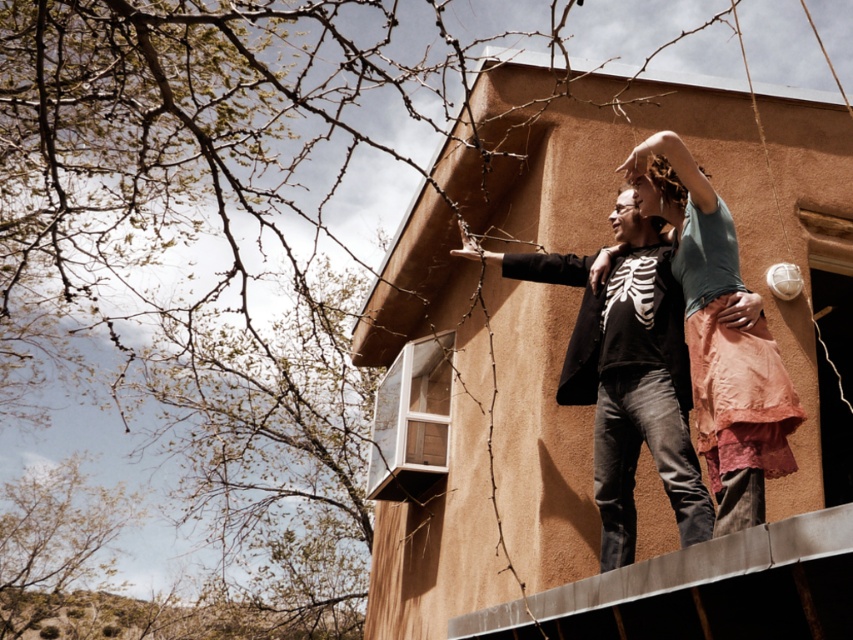
Is matte black skeleton shirt at center above light blue cotton shirt at center?

No.

Who is positioned more to the left, matte black skeleton shirt at center or light blue cotton shirt at center?

Positioned to the left is matte black skeleton shirt at center.

Is point (653, 278) less distant than point (642, 173)?

No, (653, 278) is behind (642, 173).

At what (x,y) coordinates should I click in order to perform the action: click on matte black skeleton shirt at center. Please return your answer as a coordinate pair (x, y). Looking at the image, I should click on (627, 376).